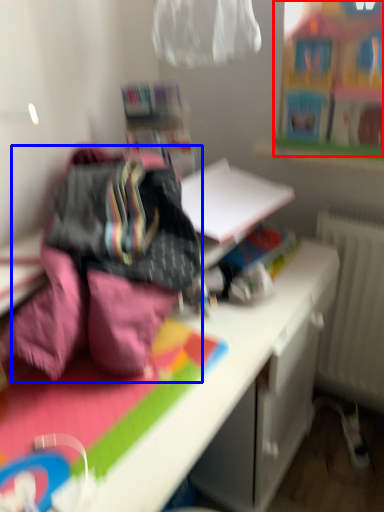
Question: Which object is closer to the camera taking this photo, toy (highlighted by a red box) or bedding (highlighted by a blue box)?

Choices:
 (A) toy
 (B) bedding

Answer: (B)